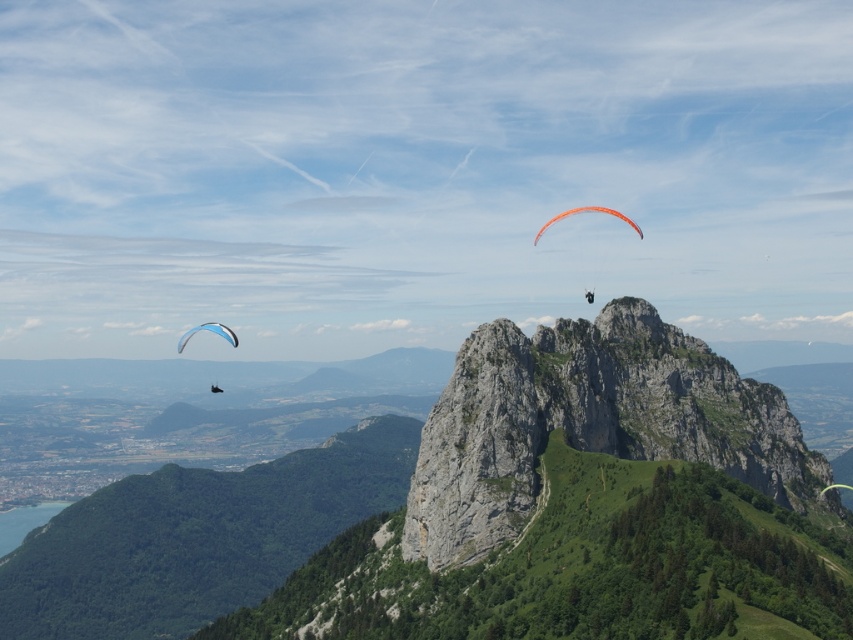
Based on the photo, you are a hiker who has just reached the summit of the mountain. You spot two parachutes in the valley below. The blue fabric parachute at lower left and the orange fabric parachute at center. Which parachute is closer to the base of the mountain?

The blue fabric parachute at lower left is closer to the base of the mountain because it is positioned below the orange fabric parachute at center.

You are a hiker planning to take a photo of the rugged stone mountain at center and the blue fabric parachute at lower left from a position near the faint path on the slope. Can you fit both objects in the frame without moving your position?

The rugged stone mountain at center is taller than the blue fabric parachute at lower left, so if you position yourself so that both are within your camera frame, the mountain will occupy more vertical space, but both should still be visible as long as their horizontal positions are within the frame.